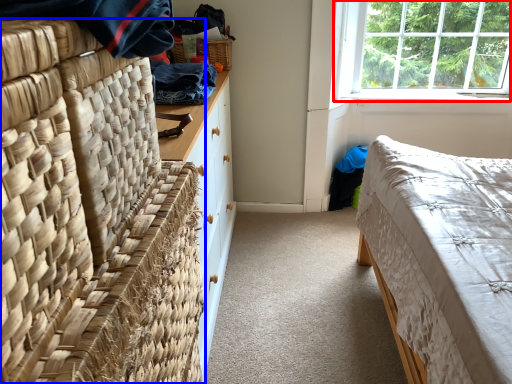
Question: Which of the following is the farthest to the observer, window (highlighted by a red box) or furniture (highlighted by a blue box)?

Choices:
 (A) window
 (B) furniture

Answer: (A)